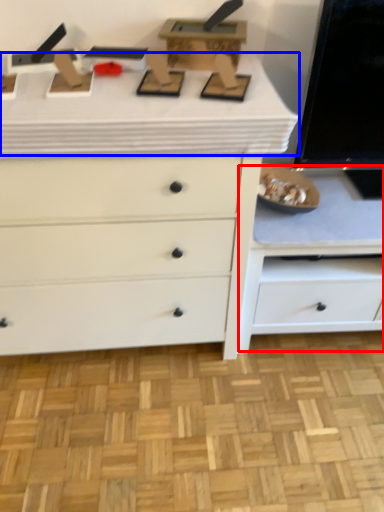
Question: Which object appears farthest to the camera in this image, cabinetry (highlighted by a red box) or counter top (highlighted by a blue box)?

Choices:
 (A) cabinetry
 (B) counter top

Answer: (A)